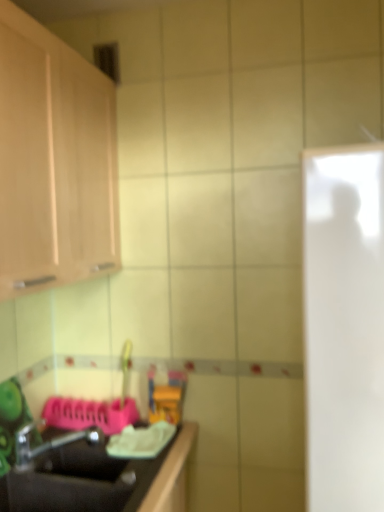
Question: Does point (326, 336) appear closer or farther from the camera than point (125, 505)?

Choices:
 (A) closer
 (B) farther

Answer: (A)

Question: Is white glossy door at right to the left or to the right of black matte sink at lower left in the image?

Choices:
 (A) right
 (B) left

Answer: (A)

Question: Based on their relative distances, which object is nearer to the light wood cabinet at upper left?

Choices:
 (A) metallic silver faucet at lower left
 (B) black matte sink at lower left
 (C) white glossy door at right

Answer: (C)

Question: Considering the real-world distances, which object is closest to the black matte sink at lower left?

Choices:
 (A) white glossy door at right
 (B) light wood cabinet at upper left
 (C) metallic silver faucet at lower left

Answer: (C)